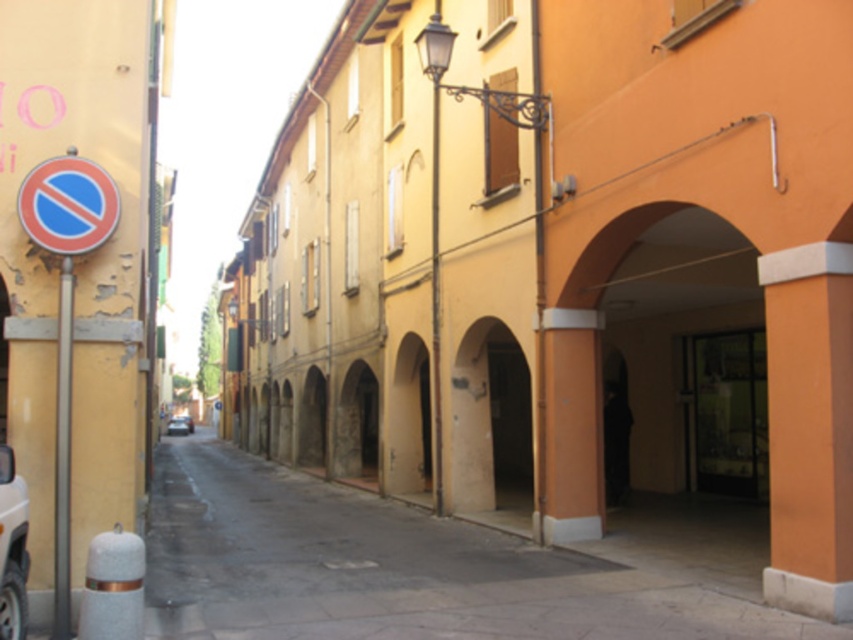
Locate an element on the screen. Image resolution: width=853 pixels, height=640 pixels. white matte car at lower left is located at coordinates (12, 548).

Between white matte car at lower left and metallic silver car at center, which one has more height?

white matte car at lower left

Is point (0, 454) farther from camera compared to point (166, 426)?

No, it is not.

The height and width of the screenshot is (640, 853). What are the coordinates of `white matte car at lower left` in the screenshot? It's located at (12, 548).

Does blue plastic circle at upper left have a lesser height compared to white matte car at lower left?

Correct, blue plastic circle at upper left is not as tall as white matte car at lower left.

Does point (80, 211) lie behind point (15, 614)?

Yes.

Which is in front, point (47, 172) or point (24, 632)?

Point (24, 632)

The width and height of the screenshot is (853, 640). I want to click on blue plastic circle at upper left, so point(68,204).

Between orange matte pillar at right and blue plastic circle at upper left, which one is positioned higher?

Positioned higher is blue plastic circle at upper left.

Between point (770, 448) and point (71, 252), which one is positioned in front?

Positioned in front is point (71, 252).

At what (x,y) coordinates should I click in order to perform the action: click on orange matte pillar at right. Please return your answer as a coordinate pair (x, y). Looking at the image, I should click on (809, 428).